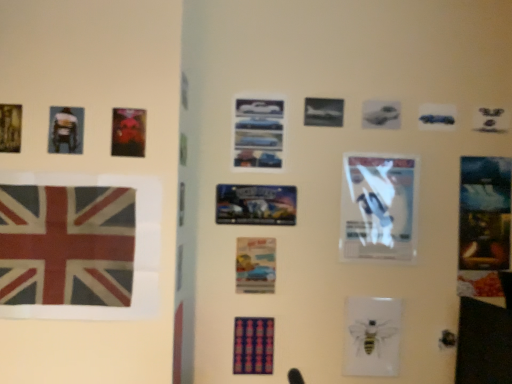
Question: From the image's perspective, is metallic silver poster at center, which is the fourth poster from top to bottom, above or below textured fabric flag at left?

Choices:
 (A) above
 (B) below

Answer: (A)

Question: Is metallic silver poster at center, which is the fifth poster from left to right, taller or shorter than textured fabric flag at left?

Choices:
 (A) tall
 (B) short

Answer: (B)

Question: Considering the real-world distances, which object is farthest from the metallic gold poster at upper left, the 6th poster in the right-to-left sequence?

Choices:
 (A) dark blue fabric poster at center, the 6th poster in the top-to-bottom sequence
 (B) watercolor paper poster at center, which is the third poster in right-to-left order
 (C) metallic silver poster at center, which is the fourth poster from top to bottom
 (D) matte black poster at upper left, which ranks as the 4th poster in bottom-to-top order
 (E) metallic blue cars at center, which is the 6th poster in left-to-right order

Answer: (A)

Question: Estimate the real-world distances between objects in this image. Which object is farther from the metallic gold poster at upper left, which appears as the second poster when viewed from the top?

Choices:
 (A) watercolor paper poster at center, acting as the second poster starting from the bottom
 (B) textured fabric flag at left
 (C) matte black poster at upper left, which ranks as the 4th poster in bottom-to-top order
 (D) metallic silver poster at center, which appears as the 3th poster when viewed from the front
 (E) dark blue fabric poster at center, the 3th poster when ordered from left to right

Answer: (E)